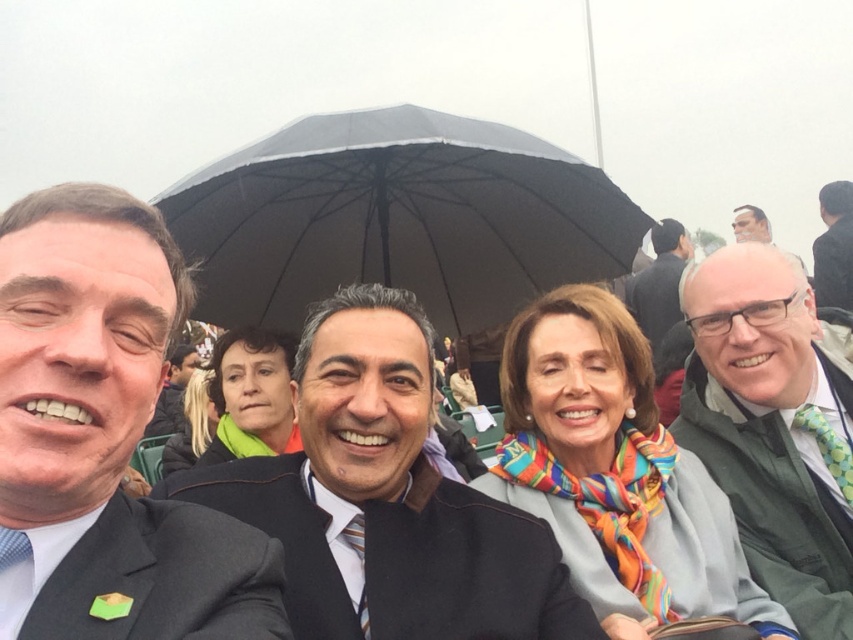
Question: Which of the following is the farthest from the observer?

Choices:
 (A) (173, 378)
 (B) (51, 618)
 (C) (317, 433)

Answer: (A)

Question: Can you confirm if green textured jacket at right is positioned to the left of matte green scarf at center?

Choices:
 (A) yes
 (B) no

Answer: (B)

Question: Among these objects, which one is nearest to the camera?

Choices:
 (A) matte black jacket at upper right
 (B) matte black suit at center
 (C) dark gray suit at upper right
 (D) blonde hair at center

Answer: (B)

Question: Is matte black umbrella at upper center below green textured jacket at right?

Choices:
 (A) no
 (B) yes

Answer: (A)

Question: Which is farther from the matte black umbrella at upper center?

Choices:
 (A) matte black suit at center
 (B) multicolored scarf at center
 (C) matte black jacket at upper right

Answer: (C)

Question: Is matte black umbrella at upper center closer to the viewer compared to dark gray suit at upper right?

Choices:
 (A) no
 (B) yes

Answer: (B)